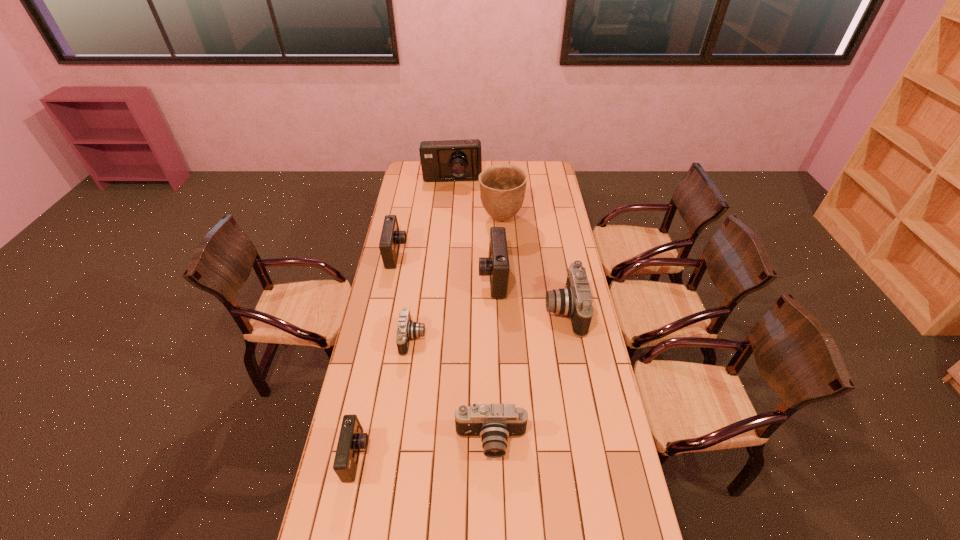
At what (x,y) coordinates should I click in order to perform the action: click on the second farthest object. Please return your answer as a coordinate pair (x, y). The image size is (960, 540). Looking at the image, I should click on (502, 187).

Where is `the farthest blue camera`? The height and width of the screenshot is (540, 960). the farthest blue camera is located at coordinates (448, 160).

Find the location of a particular element. Image resolution: width=960 pixels, height=540 pixels. the farthest camera is located at coordinates (448, 160).

I want to click on the third smallest blue camera, so click(x=496, y=265).

I want to click on the rightmost black camera, so click(575, 300).

Image resolution: width=960 pixels, height=540 pixels. Identify the location of the rightmost object. (575, 300).

Identify the location of the third biggest blue camera. The height and width of the screenshot is (540, 960). (391, 237).

Find the location of a particular element. The height and width of the screenshot is (540, 960). the nearest black camera is located at coordinates (494, 423).

Locate an element on the screen. the second biggest black camera is located at coordinates (494, 423).

At what (x,y) coordinates should I click in order to perform the action: click on the nearest blue camera. Please return your answer as a coordinate pair (x, y). This screenshot has height=540, width=960. Looking at the image, I should click on (351, 439).